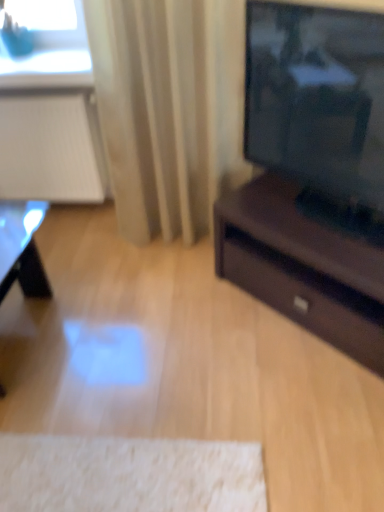
The image size is (384, 512). What do you see at coordinates (169, 109) in the screenshot? I see `beige fabric curtain at center` at bounding box center [169, 109].

This screenshot has height=512, width=384. What do you see at coordinates (49, 39) in the screenshot?
I see `blue matte glass at upper left` at bounding box center [49, 39].

The image size is (384, 512). Describe the element at coordinates (22, 249) in the screenshot. I see `shiny black table at lower left` at that location.

Where is `beige fabric curtain at center`? This screenshot has width=384, height=512. beige fabric curtain at center is located at coordinates (169, 109).

Based on the photo, considering the sizes of objects blue matte glass at upper left and beige fabric curtain at center in the image provided, who is smaller, blue matte glass at upper left or beige fabric curtain at center?

With smaller size is blue matte glass at upper left.

From a real-world perspective, is blue matte glass at upper left over beige fabric curtain at center?

Yes, from a real-world perspective, blue matte glass at upper left is on top of beige fabric curtain at center.

From the image's perspective, is blue matte glass at upper left beneath beige fabric curtain at center?

No.

Which is behind, point (0, 46) or point (204, 157)?

The point (204, 157) is farther.

From a real-world perspective, is blue matte glass at upper left positioned under shiny black table at lower left based on gravity?

Incorrect, from a real-world perspective, blue matte glass at upper left is higher than shiny black table at lower left.

Considering the relative sizes of blue matte glass at upper left and shiny black table at lower left in the image provided, is blue matte glass at upper left thinner than shiny black table at lower left?

Indeed, blue matte glass at upper left has a lesser width compared to shiny black table at lower left.

Which is correct: blue matte glass at upper left is inside shiny black table at lower left, or outside of it?

blue matte glass at upper left is not inside shiny black table at lower left, it's outside.

In terms of height, does blue matte glass at upper left look taller or shorter compared to shiny black table at lower left?

blue matte glass at upper left is shorter than shiny black table at lower left.

Considering the sizes of beige fabric curtain at center and blue matte glass at upper left in the image, is beige fabric curtain at center taller or shorter than blue matte glass at upper left?

beige fabric curtain at center is taller than blue matte glass at upper left.

Which point is more forward, [87,3] or [37,63]?

Point [87,3]

Which object is further away from the camera taking this photo, beige fabric curtain at center or blue matte glass at upper left?

blue matte glass at upper left.

Are beige fabric curtain at center and shiny black table at lower left making contact?

No, beige fabric curtain at center is not beside shiny black table at lower left.

Considering the relative sizes of beige fabric curtain at center and shiny black table at lower left in the image provided, is beige fabric curtain at center thinner than shiny black table at lower left?

Yes.

Which of these two, beige fabric curtain at center or shiny black table at lower left, is smaller?

With smaller size is shiny black table at lower left.

Does shiny black table at lower left have a greater width compared to blue matte glass at upper left?

Correct, the width of shiny black table at lower left exceeds that of blue matte glass at upper left.

Based on the photo, would you say shiny black table at lower left is outside blue matte glass at upper left?

Yes, shiny black table at lower left is not within blue matte glass at upper left.

Considering the relative positions of shiny black table at lower left and blue matte glass at upper left in the image provided, is shiny black table at lower left to the right of blue matte glass at upper left from the viewer's perspective?

Indeed, shiny black table at lower left is positioned on the right side of blue matte glass at upper left.

Which object is further away from the camera, shiny black table at lower left or beige fabric curtain at center?

beige fabric curtain at center.

How many degrees apart are the facing directions of shiny black table at lower left and beige fabric curtain at center?

6.08 degrees separate the facing orientations of shiny black table at lower left and beige fabric curtain at center.

Does shiny black table at lower left have a greater width compared to beige fabric curtain at center?

Yes, shiny black table at lower left is wider than beige fabric curtain at center.

Find the location of a particular element. The height and width of the screenshot is (512, 384). curtain above the shiny black table at lower left (from a real-world perspective) is located at coordinates (169, 109).

You are a GUI agent. You are given a task and a screenshot of the screen. Output one action in this format:
    pyautogui.click(x=<x>, y=<y>)
    Task: Click on the curtain located underneath the blue matte glass at upper left (from a real-world perspective)
    
    Given the screenshot: What is the action you would take?
    pyautogui.click(x=169, y=109)

Find the location of a particular element. Image resolution: width=384 pixels, height=512 pixels. table on the right of the blue matte glass at upper left is located at coordinates coord(22,249).

Estimate the real-world distances between objects in this image. Which object is closer to shiny black table at lower left, blue matte glass at upper left or beige fabric curtain at center?

beige fabric curtain at center lies closer to shiny black table at lower left than the other object.

When comparing their distances from blue matte glass at upper left, does beige fabric curtain at center or shiny black table at lower left seem closer?

The object closer to blue matte glass at upper left is beige fabric curtain at center.

Looking at the image, which one is located closer to blue matte glass at upper left, shiny black table at lower left or beige fabric curtain at center?

beige fabric curtain at center is closer to blue matte glass at upper left.

Which object lies nearer to the anchor point shiny black table at lower left, beige fabric curtain at center or blue matte glass at upper left?

beige fabric curtain at center is closer to shiny black table at lower left.

Based on their spatial positions, is shiny black table at lower left or blue matte glass at upper left further from beige fabric curtain at center?

shiny black table at lower left is further to beige fabric curtain at center.

From the image, which object appears to be farther from beige fabric curtain at center, blue matte glass at upper left or shiny black table at lower left?

shiny black table at lower left.

What are the coordinates of `curtain between blue matte glass at upper left and shiny black table at lower left vertically` in the screenshot? It's located at (169, 109).